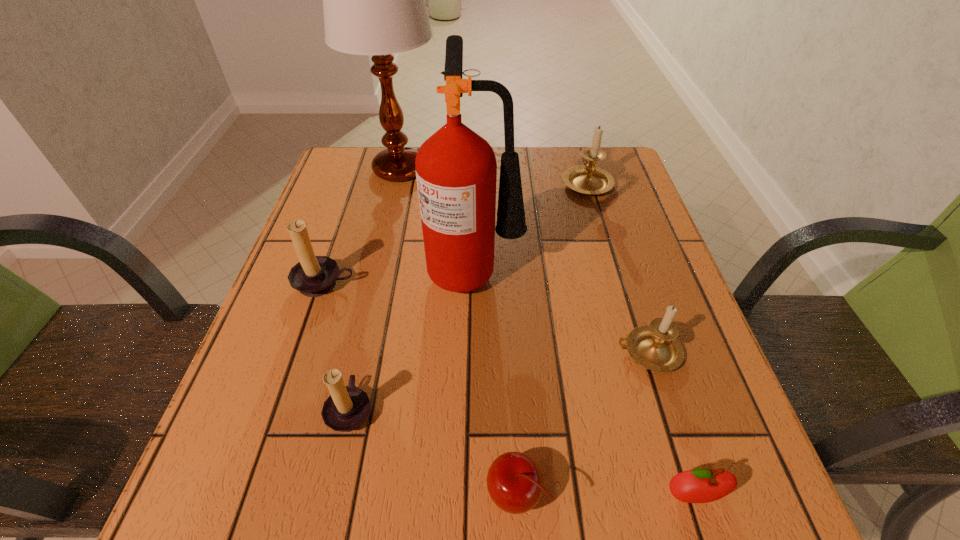
The height and width of the screenshot is (540, 960). In the image, there is a desktop. In order to click on vacant region at the left edge in this screenshot , I will do `click(348, 282)`.

Identify the location of vacant space at the right edge of the desktop. (646, 247).

What are the coordinates of `free space at the near left corner of the desktop` in the screenshot? It's located at (234, 509).

I want to click on free spot at the far right corner of the desktop, so click(x=622, y=173).

Where is `blank region between the cherry and the fire extinguisher`? blank region between the cherry and the fire extinguisher is located at coordinates (495, 381).

Locate an element on the screen. Image resolution: width=960 pixels, height=540 pixels. empty space between the smaller beige candle holder and the second candle holder from left to right is located at coordinates click(x=499, y=380).

You are a GUI agent. You are given a task and a screenshot of the screen. Output one action in this format:
    pyautogui.click(x=<x>, y=<y>)
    Task: Click on the unoccupied area between the cherry and the leftmost candle holder
    The height and width of the screenshot is (540, 960).
    Given the screenshot: What is the action you would take?
    pyautogui.click(x=420, y=388)

I want to click on unoccupied position between the table lamp and the nearer beige candle holder, so click(523, 261).

Where is `free space between the white table lamp and the nearer brown candle holder`? The height and width of the screenshot is (540, 960). free space between the white table lamp and the nearer brown candle holder is located at coordinates (374, 289).

In order to click on free space between the white table lamp and the second candle holder from left to right in this screenshot , I will do `click(374, 289)`.